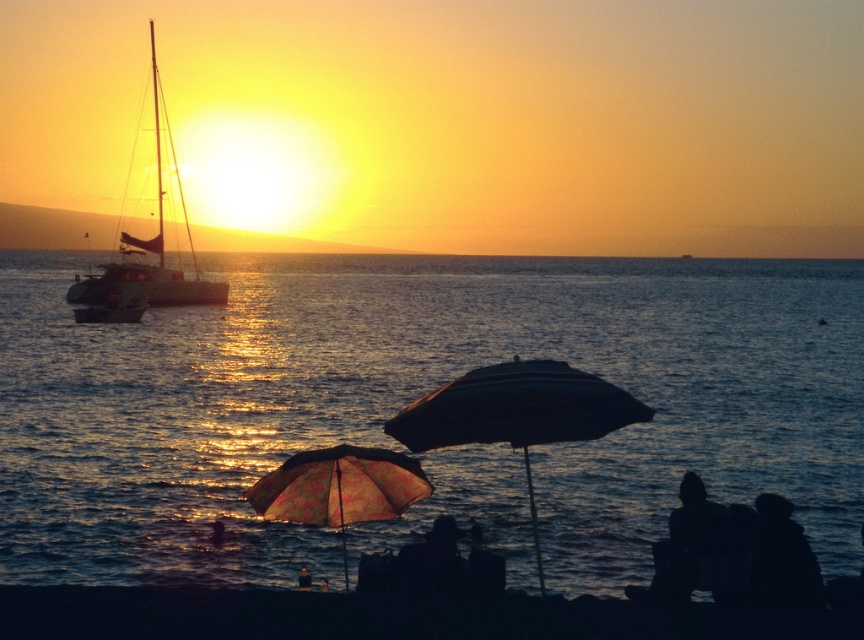
You are a photographer trying to capture the sunset. You want to ensure that both the blue water at center and the dark striped umbrella at center are visible in your shot. Based on their positions, which object should appear in front of the other in your photo?

The blue water at center is positioned over dark striped umbrella at center, so the blue water at center will appear in front of the dark striped umbrella at center in the photo.

You are standing on the beach looking at the sunset. Where is the blue water at center located in terms of coordinates?

The blue water at center is located at coordinates point (414, 397).